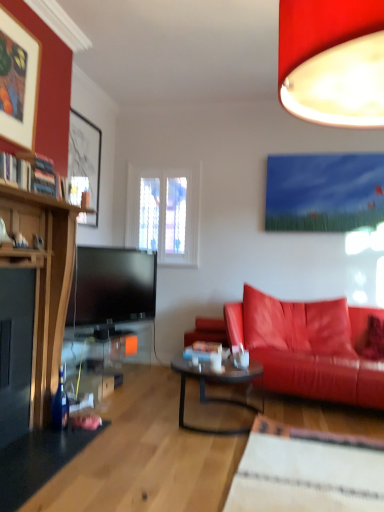
Locate an element on the screen. Image resolution: width=384 pixels, height=512 pixels. wooden picture frame at upper left, the 1th picture frame when ordered from front to back is located at coordinates (x=18, y=81).

The image size is (384, 512). Describe the element at coordinates (307, 347) in the screenshot. I see `shiny leather couch at right` at that location.

The height and width of the screenshot is (512, 384). What do you see at coordinates (332, 61) in the screenshot?
I see `matte red lampshade at upper right` at bounding box center [332, 61].

Locate an element on the screen. The width and height of the screenshot is (384, 512). wooden picture frame at upper left, the 1th picture frame when ordered from front to back is located at coordinates (18, 81).

This screenshot has width=384, height=512. I want to click on picture frame that is the 1st one when counting backward from the hardcover books at upper left, so click(x=18, y=81).

Between hardcover books at upper left and wooden picture frame at upper left, the 1th picture frame when ordered from front to back, which one has more height?

wooden picture frame at upper left, the 1th picture frame when ordered from front to back.

Is hardcover books at upper left looking in the opposite direction of wooden picture frame at upper left, the 1th picture frame when ordered from front to back?

hardcover books at upper left is not turned away from wooden picture frame at upper left, the 1th picture frame when ordered from front to back.

From a real-world perspective, is hardcover books at upper left physically located above or below wooden picture frame at upper left, the 1th picture frame when ordered from front to back?

From a real-world perspective, hardcover books at upper left is physically below wooden picture frame at upper left, the 1th picture frame when ordered from front to back.

Between point (265, 339) and point (91, 162), which one is positioned behind?

The point (91, 162) is behind.

The height and width of the screenshot is (512, 384). I want to click on studio couch directly beneath the matte black picture frame at upper left, which is counted as the first picture frame, starting from the back (from a real-world perspective), so click(x=307, y=347).

Can we say shiny leather couch at right lies outside matte black picture frame at upper left, which is counted as the first picture frame, starting from the back?

shiny leather couch at right is positioned outside matte black picture frame at upper left, which is counted as the first picture frame, starting from the back.

Relative to matte black picture frame at upper left, marked as the second picture frame in a front-to-back arrangement, is shiny leather couch at right in front or behind?

Visually, shiny leather couch at right is located in front of matte black picture frame at upper left, marked as the second picture frame in a front-to-back arrangement.

From the image's perspective, who appears lower, hardcover books at upper left or shiny leather couch at right?

shiny leather couch at right, from the image's perspective.

Is hardcover books at upper left to the right of shiny leather couch at right from the viewer's perspective?

No, hardcover books at upper left is not to the right of shiny leather couch at right.

Does translucent glass coffee table at center have a larger size compared to matte black picture frame at upper left, which is counted as the first picture frame, starting from the back?

Indeed, translucent glass coffee table at center has a larger size compared to matte black picture frame at upper left, which is counted as the first picture frame, starting from the back.

Are translucent glass coffee table at center and matte black picture frame at upper left, which is counted as the first picture frame, starting from the back, located far from each other?

translucent glass coffee table at center is far away from matte black picture frame at upper left, which is counted as the first picture frame, starting from the back.

I want to click on coffee table in front of the matte black picture frame at upper left, which is counted as the first picture frame, starting from the back, so tap(218, 383).

From the image's perspective, is translucent glass coffee table at center positioned above or below matte black picture frame at upper left, marked as the second picture frame in a front-to-back arrangement?

translucent glass coffee table at center is below matte black picture frame at upper left, marked as the second picture frame in a front-to-back arrangement.

This screenshot has height=512, width=384. What are the coordinates of `book above the translucent glass coffee table at center (from a real-world perspective)` in the screenshot? It's located at (29, 173).

Is hardcover books at upper left inside the boundaries of translucent glass coffee table at center, or outside?

hardcover books at upper left cannot be found inside translucent glass coffee table at center.

Is there a large distance between hardcover books at upper left and translucent glass coffee table at center?

Absolutely, hardcover books at upper left is distant from translucent glass coffee table at center.

From the image's perspective, does hardcover books at upper left appear higher than translucent glass coffee table at center?

Yes.

How distant is matte red lampshade at upper right from wooden picture frame at upper left, which appears as the second picture frame when viewed from the back?

matte red lampshade at upper right is 1.69 meters from wooden picture frame at upper left, which appears as the second picture frame when viewed from the back.

Which is nearer, (x=297, y=39) or (x=20, y=61)?

Point (x=297, y=39) is closer to the camera than point (x=20, y=61).

Is matte red lampshade at upper right positioned with its back to wooden picture frame at upper left, the 1th picture frame when ordered from front to back?

matte red lampshade at upper right is not turned away from wooden picture frame at upper left, the 1th picture frame when ordered from front to back.

Are hardcover books at upper left and matte red lampshade at upper right beside each other?

hardcover books at upper left is not next to matte red lampshade at upper right, and they're not touching.

Would you say hardcover books at upper left is inside or outside matte red lampshade at upper right?

hardcover books at upper left is spatially situated outside matte red lampshade at upper right.

From a real-world perspective, is hardcover books at upper left below matte red lampshade at upper right?

Correct, in the physical world, hardcover books at upper left is lower than matte red lampshade at upper right.

From the image's perspective, starting from the hardcover books at upper left, which picture frame is the 2nd one above? Please provide its 2D coordinates.

[(18, 81)]

This screenshot has width=384, height=512. Identify the location of the 1st picture frame positioned above the shiny leather couch at right (from a real-world perspective). (85, 159).

From the picture: From the image, which object appears to be farther from shiny leather couch at right, translucent glass coffee table at center or matte black picture frame at upper left, which is counted as the first picture frame, starting from the back?

Among the two, matte black picture frame at upper left, which is counted as the first picture frame, starting from the back, is located further to shiny leather couch at right.

Looking at the image, which one is located closer to shiny leather couch at right, hardcover books at upper left or matte black picture frame at upper left, which is counted as the first picture frame, starting from the back?

Based on the image, hardcover books at upper left appears to be nearer to shiny leather couch at right.

Considering their positions, is translucent glass coffee table at center positioned closer to wooden picture frame at upper left, the 1th picture frame when ordered from front to back, than hardcover books at upper left?

hardcover books at upper left is positioned closer to the anchor wooden picture frame at upper left, the 1th picture frame when ordered from front to back.

Based on their spatial positions, is hardcover books at upper left or translucent glass coffee table at center further from matte black picture frame at upper left, which is counted as the first picture frame, starting from the back?

translucent glass coffee table at center is positioned further to the anchor matte black picture frame at upper left, which is counted as the first picture frame, starting from the back.

Which object lies further to the anchor point hardcover books at upper left, shiny leather couch at right or matte black picture frame at upper left, which is counted as the first picture frame, starting from the back?

shiny leather couch at right.

Looking at the image, which one is located closer to matte black picture frame at upper left, marked as the second picture frame in a front-to-back arrangement, shiny leather couch at right or translucent glass coffee table at center?

translucent glass coffee table at center is closer to matte black picture frame at upper left, marked as the second picture frame in a front-to-back arrangement.

From the picture: Which object lies nearer to the anchor point translucent glass coffee table at center, shiny leather couch at right or matte red lampshade at upper right?

shiny leather couch at right is positioned closer to the anchor translucent glass coffee table at center.

From the image, which object appears to be nearer to matte red lampshade at upper right, wooden picture frame at upper left, the 1th picture frame when ordered from front to back, or translucent glass coffee table at center?

wooden picture frame at upper left, the 1th picture frame when ordered from front to back, lies closer to matte red lampshade at upper right than the other object.

The image size is (384, 512). I want to click on book between wooden picture frame at upper left, the 1th picture frame when ordered from front to back, and translucent glass coffee table at center from top to bottom, so click(29, 173).

Where is `book between wooden picture frame at upper left, the 1th picture frame when ordered from front to back, and shiny leather couch at right`? Image resolution: width=384 pixels, height=512 pixels. book between wooden picture frame at upper left, the 1th picture frame when ordered from front to back, and shiny leather couch at right is located at coordinates (29, 173).

At what (x,y) coordinates should I click in order to perform the action: click on studio couch between matte red lampshade at upper right and matte black picture frame at upper left, which is counted as the first picture frame, starting from the back, in the front-back direction. Please return your answer as a coordinate pair (x, y). This screenshot has width=384, height=512. Looking at the image, I should click on (307, 347).

Identify the location of picture frame between hardcover books at upper left and matte black picture frame at upper left, marked as the second picture frame in a front-to-back arrangement, along the z-axis. The height and width of the screenshot is (512, 384). (18, 81).